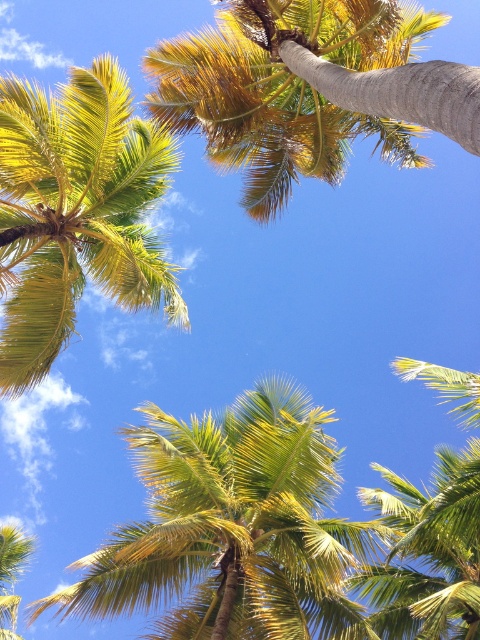
Who is positioned more to the left, green leafy palm at center or green leafy coconut tree at upper center?

green leafy palm at center is more to the left.

Does green leafy palm at center appear on the right side of green leafy coconut tree at upper center?

No, green leafy palm at center is not to the right of green leafy coconut tree at upper center.

Between point (298, 506) and point (343, 52), which one is positioned behind?

Point (343, 52)

What are the coordinates of `green leafy palm at center` in the screenshot? It's located at (232, 528).

Is point (121, 124) positioned after point (394, 10)?

Yes.

Who is shorter, golden yellow leaves at upper left or green leafy coconut tree at upper center?

Standing shorter between the two is golden yellow leaves at upper left.

The image size is (480, 640). What are the coordinates of `golden yellow leaves at upper left` in the screenshot? It's located at (75, 212).

Is green leafy palm at center behind green leafy palm at lower left?

No, it is not.

Is green leafy palm at center in front of green leafy palm at lower left?

Yes, green leafy palm at center is in front of green leafy palm at lower left.

You are a GUI agent. You are given a task and a screenshot of the screen. Output one action in this format:
    pyautogui.click(x=<x>, y=<y>)
    Task: Click on the green leafy palm at center
    This screenshot has height=640, width=480.
    Given the screenshot: What is the action you would take?
    pyautogui.click(x=232, y=528)